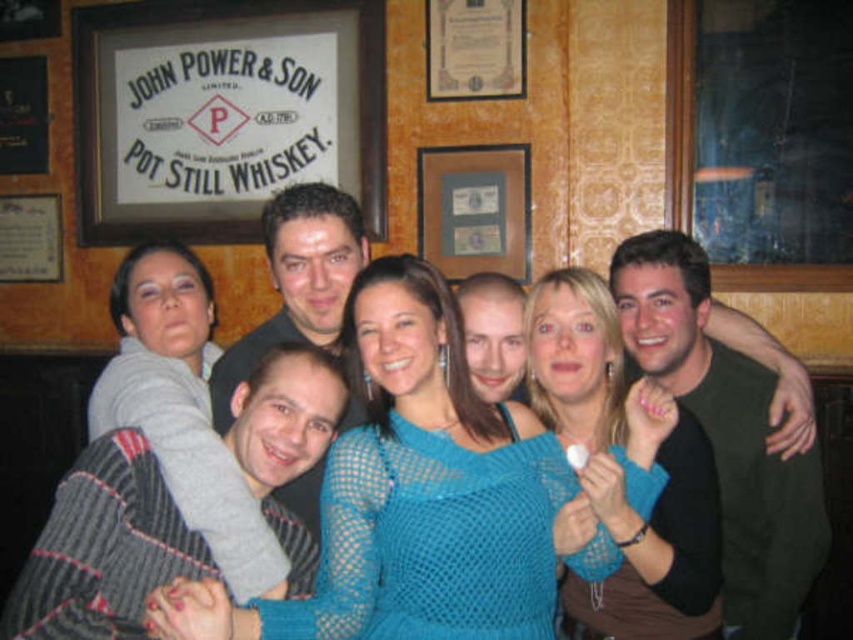
Is point (96, 118) farther from viewer compared to point (38, 604)?

That is True.

Between white paper sign at upper left and striped sweater at center, which one appears on the right side from the viewer's perspective?

From the viewer's perspective, striped sweater at center appears more on the right side.

The image size is (853, 640). Find the location of `white paper sign at upper left`. white paper sign at upper left is located at coordinates (223, 113).

Does white paper sign at upper left appear under blue knitted sweater at center?

Actually, white paper sign at upper left is above blue knitted sweater at center.

Who is positioned more to the left, white paper sign at upper left or blue knitted sweater at center?

white paper sign at upper left is more to the left.

Is point (164, 180) positioned behind point (664, 548)?

Yes, point (164, 180) is behind point (664, 548).

Where is `white paper sign at upper left`? This screenshot has height=640, width=853. white paper sign at upper left is located at coordinates (223, 113).

Is point (676, 480) positioned in front of point (123, 422)?

No, it is not.

Which is above, blue knitted sweater at center or knitted gray sweater at center?

Positioned higher is knitted gray sweater at center.

Which is in front, point (605, 333) or point (161, 390)?

Point (161, 390)

The height and width of the screenshot is (640, 853). What are the coordinates of `blue knitted sweater at center` in the screenshot? It's located at (618, 480).